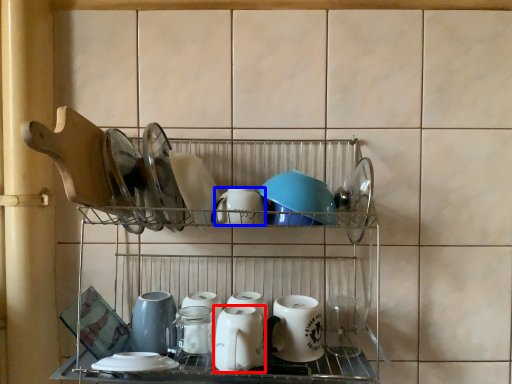
Question: Which of the following is the farthest to the observer, tableware (highlighted by a red box) or tableware (highlighted by a blue box)?

Choices:
 (A) tableware
 (B) tableware

Answer: (B)